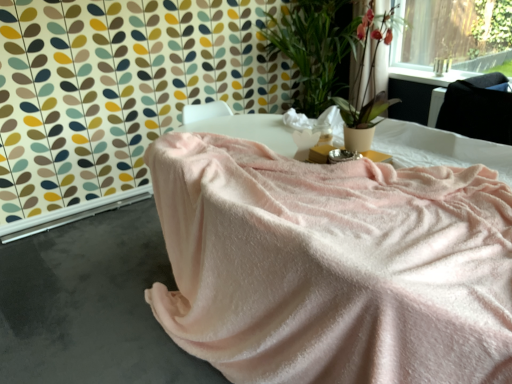
Question: From a real-world perspective, is pink soft fabric at center physically above satin black at upper right?

Choices:
 (A) no
 (B) yes

Answer: (A)

Question: From the image's perspective, is pink soft fabric at center below satin black at upper right?

Choices:
 (A) no
 (B) yes

Answer: (B)

Question: Is pink soft fabric at center surrounding satin black at upper right?

Choices:
 (A) no
 (B) yes

Answer: (A)

Question: Is pink soft fabric at center smaller than satin black at upper right?

Choices:
 (A) yes
 (B) no

Answer: (B)

Question: Is pink soft fabric at center bigger than satin black at upper right?

Choices:
 (A) no
 (B) yes

Answer: (B)

Question: Is pink soft fabric at center further to the viewer compared to satin black at upper right?

Choices:
 (A) yes
 (B) no

Answer: (B)

Question: From the image's perspective, would you say satin black at upper right is positioned over pink soft fabric at lower left?

Choices:
 (A) no
 (B) yes

Answer: (B)

Question: Is satin black at upper right to the right of pink soft fabric at lower left from the viewer's perspective?

Choices:
 (A) no
 (B) yes

Answer: (B)

Question: From a real-world perspective, is satin black at upper right located beneath pink soft fabric at lower left?

Choices:
 (A) yes
 (B) no

Answer: (B)

Question: Could you tell me if satin black at upper right is facing pink soft fabric at lower left?

Choices:
 (A) no
 (B) yes

Answer: (A)

Question: Does satin black at upper right have a greater height compared to pink soft fabric at lower left?

Choices:
 (A) yes
 (B) no

Answer: (A)

Question: From the image's perspective, is satin black at upper right beneath pink soft fabric at lower left?

Choices:
 (A) yes
 (B) no

Answer: (B)

Question: Considering the relative sizes of pink soft fabric at lower left and green leafy plant at upper right in the image provided, is pink soft fabric at lower left shorter than green leafy plant at upper right?

Choices:
 (A) no
 (B) yes

Answer: (B)